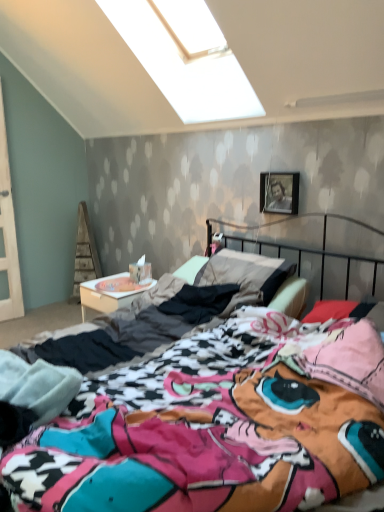
I want to click on metallic silver picture frame at upper right, so click(279, 192).

Where is `white cardboard at lower left`? white cardboard at lower left is located at coordinates (110, 293).

Describe the element at coordinates (110, 293) in the screenshot. I see `white cardboard at lower left` at that location.

Identify the location of multicolored fabric bed at center. This screenshot has width=384, height=512. (217, 424).

Would you say multicolored fabric bed at center is outside white cardboard at lower left?

Yes, multicolored fabric bed at center is located beyond the bounds of white cardboard at lower left.

From a real-world perspective, which is physically above, multicolored fabric bed at center or white cardboard at lower left?

multicolored fabric bed at center.

Considering the sizes of multicolored fabric bed at center and white cardboard at lower left in the image, is multicolored fabric bed at center bigger or smaller than white cardboard at lower left?

In the image, multicolored fabric bed at center appears to be larger than white cardboard at lower left.

From the image's perspective, is white cardboard at lower left located above or below multicolored fabric bed at center?

From the image's perspective, white cardboard at lower left appears above multicolored fabric bed at center.

Does white cardboard at lower left turn towards multicolored fabric bed at center?

No, white cardboard at lower left is not oriented towards multicolored fabric bed at center.

Considering the sizes of objects white cardboard at lower left and multicolored fabric bed at center in the image provided, who is wider, white cardboard at lower left or multicolored fabric bed at center?

multicolored fabric bed at center.

The width and height of the screenshot is (384, 512). Identify the location of bed in front of the white cardboard at lower left. (217, 424).

Would you consider multicolored fabric bed at center to be distant from metallic silver picture frame at upper right?

Yes, multicolored fabric bed at center and metallic silver picture frame at upper right are quite far apart.

Is multicolored fabric bed at center turned away from metallic silver picture frame at upper right?

No.

Is point (116, 399) closer or farther from the camera than point (274, 186)?

Point (116, 399) appears to be closer to the viewer than point (274, 186).

Between metallic silver picture frame at upper right and multicolored fabric bed at center, which one appears on the right side from the viewer's perspective?

Positioned to the right is metallic silver picture frame at upper right.

From the picture: From a real-world perspective, is metallic silver picture frame at upper right below multicolored fabric bed at center?

No, from a real-world perspective, metallic silver picture frame at upper right is not below multicolored fabric bed at center.

Does metallic silver picture frame at upper right have a greater width compared to multicolored fabric bed at center?

No.

Is there a large distance between metallic silver picture frame at upper right and multicolored fabric bed at center?

Absolutely, metallic silver picture frame at upper right is distant from multicolored fabric bed at center.

From the image's perspective, is metallic silver picture frame at upper right above white cardboard at lower left?

Indeed, from the image's perspective, metallic silver picture frame at upper right is shown above white cardboard at lower left.

Is point (271, 197) positioned behind point (141, 288)?

No, (271, 197) is closer to viewer.

Based on the photo, is metallic silver picture frame at upper right to the left of white cardboard at lower left from the viewer's perspective?

In fact, metallic silver picture frame at upper right is to the right of white cardboard at lower left.

Is white cardboard at lower left positioned with its back to metallic silver picture frame at upper right?

white cardboard at lower left is not turned away from metallic silver picture frame at upper right.

From the image's perspective, which object appears higher, white cardboard at lower left or metallic silver picture frame at upper right?

metallic silver picture frame at upper right appears higher in the image.

Where is `picture frame above the white cardboard at lower left (from a real-world perspective)`? picture frame above the white cardboard at lower left (from a real-world perspective) is located at coordinates (279, 192).

In terms of height, does white cardboard at lower left look taller or shorter compared to metallic silver picture frame at upper right?

white cardboard at lower left is taller than metallic silver picture frame at upper right.

The width and height of the screenshot is (384, 512). What are the coordinates of `bed that is below the white cardboard at lower left (from the image's perspective)` in the screenshot? It's located at (217, 424).

The height and width of the screenshot is (512, 384). Find the location of `bed above the white cardboard at lower left (from a real-world perspective)`. bed above the white cardboard at lower left (from a real-world perspective) is located at coordinates (217, 424).

Based on their spatial positions, is multicolored fabric bed at center or metallic silver picture frame at upper right closer to white cardboard at lower left?

metallic silver picture frame at upper right.

From the image, which object appears to be farther from multicolored fabric bed at center, white cardboard at lower left or metallic silver picture frame at upper right?

Based on the image, metallic silver picture frame at upper right appears to be further to multicolored fabric bed at center.

Estimate the real-world distances between objects in this image. Which object is further from metallic silver picture frame at upper right, white cardboard at lower left or multicolored fabric bed at center?

multicolored fabric bed at center is positioned further to the anchor metallic silver picture frame at upper right.

Considering their positions, is metallic silver picture frame at upper right positioned closer to multicolored fabric bed at center than white cardboard at lower left?

white cardboard at lower left is positioned closer to the anchor multicolored fabric bed at center.

Estimate the real-world distances between objects in this image. Which object is further from metallic silver picture frame at upper right, multicolored fabric bed at center or white cardboard at lower left?

multicolored fabric bed at center.

Which object lies nearer to the anchor point white cardboard at lower left, metallic silver picture frame at upper right or multicolored fabric bed at center?

metallic silver picture frame at upper right is positioned closer to the anchor white cardboard at lower left.

Identify the location of picture frame positioned between multicolored fabric bed at center and white cardboard at lower left from near to far. Image resolution: width=384 pixels, height=512 pixels. click(x=279, y=192).